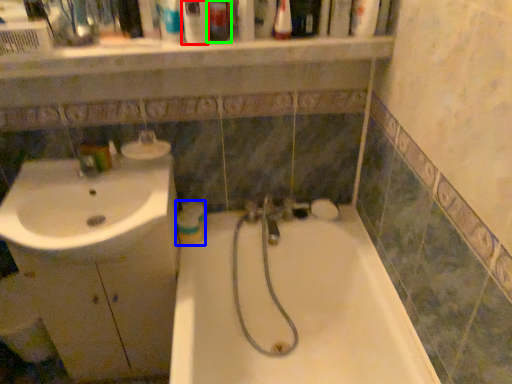
Question: Considering the real-world distances, which object is closest to mouthwash (highlighted by a red box)? mouthwash (highlighted by a blue box) or toiletry (highlighted by a green box).

Choices:
 (A) mouthwash
 (B) toiletry

Answer: (B)